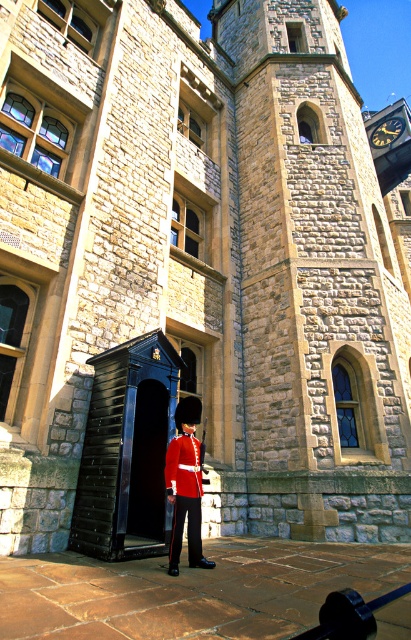
Question: Which point appears closest to the camera in this image?

Choices:
 (A) (175, 502)
 (B) (383, 122)

Answer: (A)

Question: Can you confirm if black glossy door at center is positioned below shiny red uniform at center?

Choices:
 (A) yes
 (B) no

Answer: (B)

Question: Which of the following is the closest to the observer?

Choices:
 (A) (161, 438)
 (B) (180, 490)
 (C) (401, 122)

Answer: (B)

Question: From the image, what is the correct spatial relationship of black glossy door at center in relation to shiny red uniform at center?

Choices:
 (A) right
 (B) left

Answer: (B)

Question: Which object is farther from the camera taking this photo?

Choices:
 (A) shiny red uniform at center
 (B) black glossy door at center
 (C) metallic clock at upper right

Answer: (C)

Question: In this image, where is black glossy door at center located relative to metallic clock at upper right?

Choices:
 (A) right
 (B) left

Answer: (B)